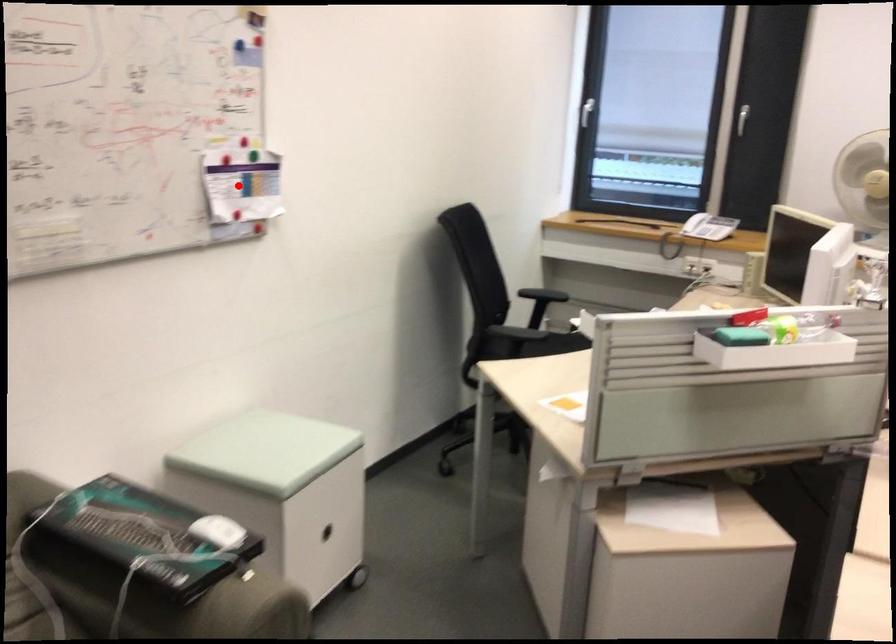
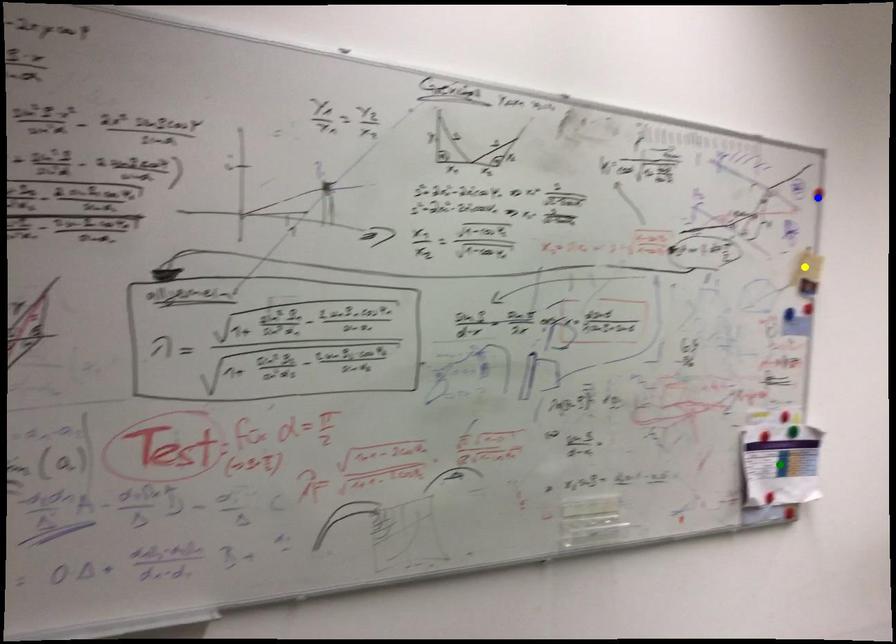
Question: I am providing you with two images of the same scene from different viewpoints. A red point is marked on the first image. You are given multiple points on the second image. Which point in image 2 is actually the same real-world point as the red point in image 1?

Choices:
 (A) blue point
 (B) green point
 (C) yellow point

Answer: (B)